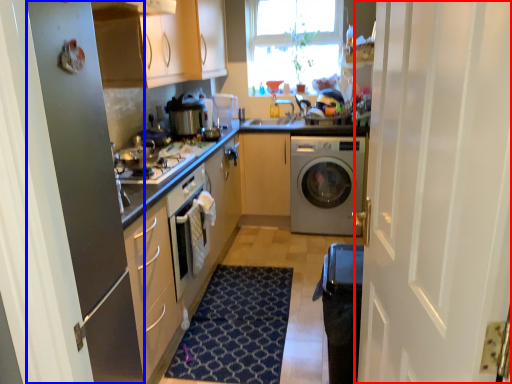
Question: Which object appears closest to the camera in this image, door (highlighted by a red box) or screen door (highlighted by a blue box)?

Choices:
 (A) door
 (B) screen door

Answer: (A)